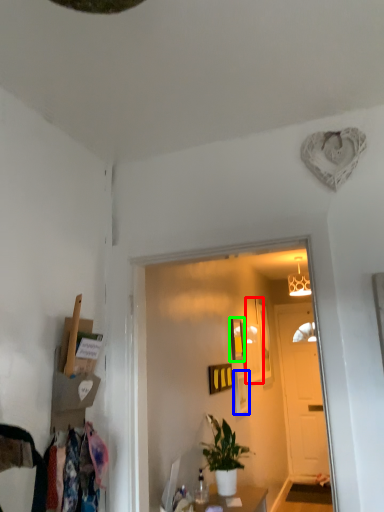
Question: Which object is positioned farthest from picture frame (highlighted by a red box)? Select from picture frame (highlighted by a blue box) and picture frame (highlighted by a green box).

Choices:
 (A) picture frame
 (B) picture frame

Answer: (B)